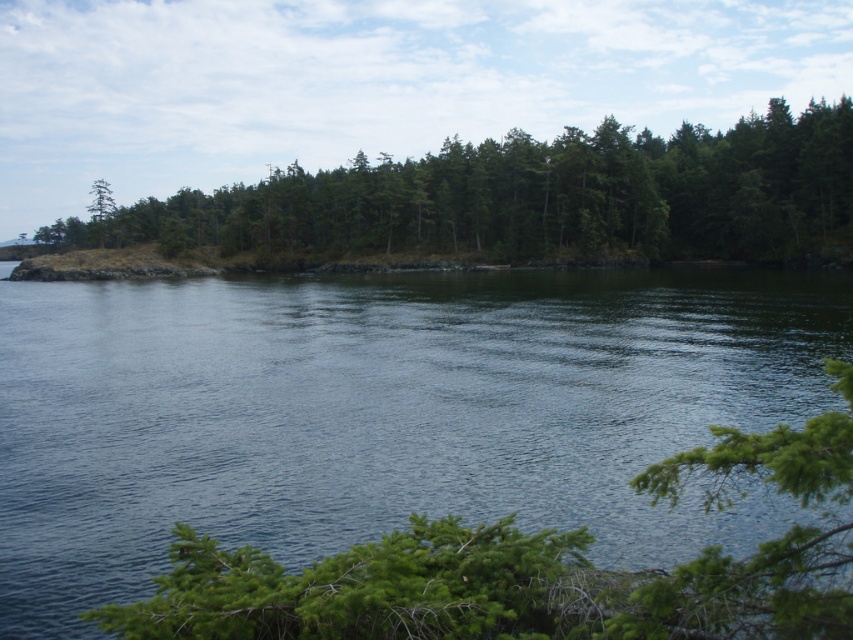
Question: Is blue water at center further to the viewer compared to green textured trees at center?

Choices:
 (A) yes
 (B) no

Answer: (B)

Question: Which object appears farthest from the camera in this image?

Choices:
 (A) blue water at center
 (B) green textured trees at center

Answer: (B)

Question: Can you confirm if blue water at center is smaller than green textured trees at center?

Choices:
 (A) yes
 (B) no

Answer: (A)

Question: Which point appears closest to the camera in this image?

Choices:
 (A) (202, 452)
 (B) (402, 200)

Answer: (A)

Question: Can you confirm if blue water at center is positioned to the left of green textured trees at center?

Choices:
 (A) yes
 (B) no

Answer: (B)